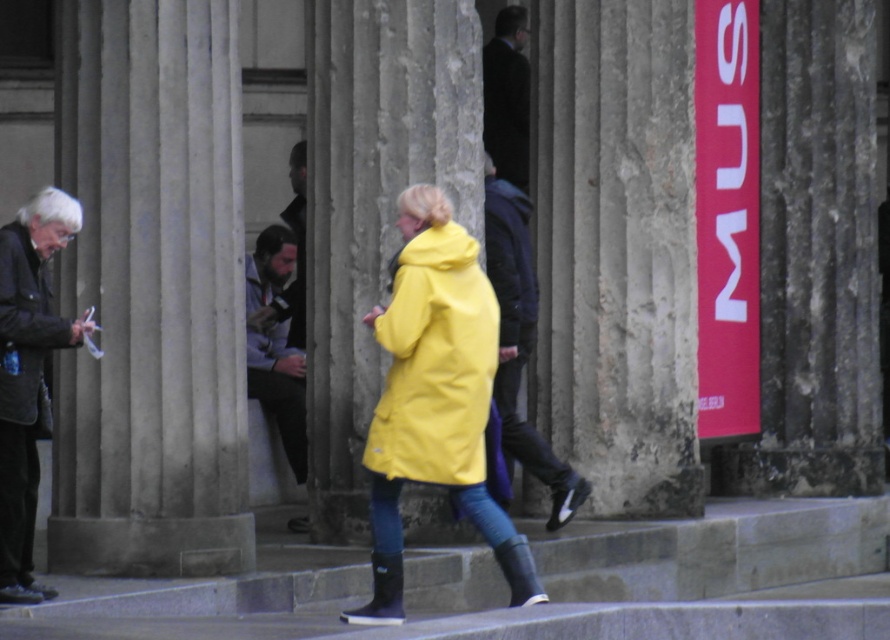
Based on the photo, you are a delivery person needing to place a 5 meter long package between the smooth concrete pillar at left and the yellow matte jacket at center. Can you fit the package between them?

The smooth concrete pillar at left and yellow matte jacket at center are 4.62 meters apart, so the 5 meter long package cannot fit between them as it is longer than the available space.

You are standing at the point with coordinates point (298, 228) in the urban scene. You want to take a photo of the point (486, 92) but there is a classical column in the way. Can you move to a position where you can see both points without obstruction?

Since point (486, 92) is behind point (298, 228), moving to a position where both points are visible without obstruction might not be possible as the column between them may block the view. However, if you move to the side of the column, you might be able to see both points depending on their exact positions and the column size.

You are a delivery person needing to pass through the space between the smooth concrete pillar at left and the yellow matte jacket at center. The delivery cart you are pushing is 1.2 meters wide. Can you fit through the space?

The smooth concrete pillar at left is thinner than the yellow matte jacket at center, but the exact width of the space between them isn not provided in the objects description. Therefore, it is uncertain if the 1.2 meter wide delivery cart can fit through the space.